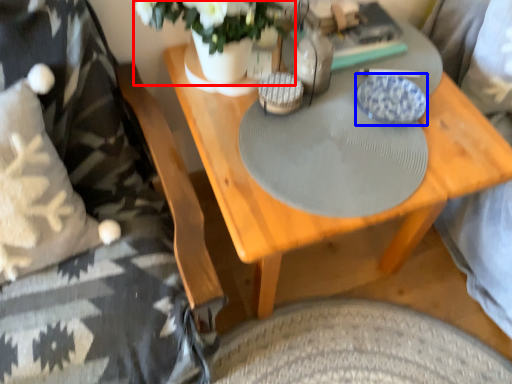
Question: Which object is further to the camera taking this photo, floral arrangement (highlighted by a red box) or plate (highlighted by a blue box)?

Choices:
 (A) floral arrangement
 (B) plate

Answer: (B)